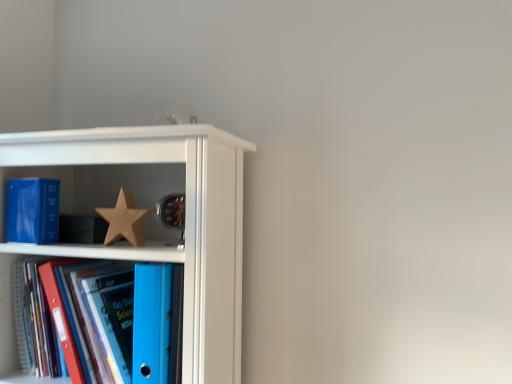
In order to click on blue plastic folder at lower left in this screenshot , I will do `click(97, 320)`.

Find the location of a particular element. white glossy bookshelf at upper left is located at coordinates (154, 219).

Would you say matte blue paperback book at left is a long distance from blue plastic folder at lower left?

That's not correct — matte blue paperback book at left is a little close to blue plastic folder at lower left.

Is matte blue paperback book at left in front of blue plastic folder at lower left?

No, it is not.

Is matte blue paperback book at left at the right side of blue plastic folder at lower left?

No.

Which of these two, matte blue paperback book at left or blue plastic folder at lower left, is bigger?

Bigger between the two is blue plastic folder at lower left.

Does blue plastic folder at lower left appear on the left side of white glossy bookshelf at upper left?

Yes.

Does blue plastic folder at lower left turn towards white glossy bookshelf at upper left?

Yes.

Is blue plastic folder at lower left positioned before white glossy bookshelf at upper left?

No, the depth of blue plastic folder at lower left is greater than that of white glossy bookshelf at upper left.

From a real-world perspective, is blue plastic folder at lower left over white glossy bookshelf at upper left?

No, from a real-world perspective, blue plastic folder at lower left is not over white glossy bookshelf at upper left

Which of these two, wooden star at center or matte blue paperback book at left, is wider?

matte blue paperback book at left.

In terms of height, does wooden star at center look taller or shorter compared to matte blue paperback book at left?

In the image, wooden star at center appears to be shorter than matte blue paperback book at left.

Based on their sizes in the image, would you say wooden star at center is bigger or smaller than matte blue paperback book at left?

Considering their sizes, wooden star at center takes up less space than matte blue paperback book at left.

From a real-world perspective, is wooden star at center located beneath matte blue paperback book at left?

Indeed, from a real-world perspective, wooden star at center is positioned beneath matte blue paperback book at left.

Does blue plastic folder at lower left have a greater width compared to matte blue paperback book at left?

Correct, the width of blue plastic folder at lower left exceeds that of matte blue paperback book at left.

Can you tell me how much blue plastic folder at lower left and matte blue paperback book at left differ in facing direction?

The angle between the facing direction of blue plastic folder at lower left and the facing direction of matte blue paperback book at left is 2.69 degrees.

Is blue plastic folder at lower left far away from matte blue paperback book at left?

Actually, blue plastic folder at lower left and matte blue paperback book at left are a little close together.

From a real-world perspective, is blue plastic folder at lower left located beneath matte blue paperback book at left?

Correct, in the physical world, blue plastic folder at lower left is lower than matte blue paperback book at left.

From the image's perspective, does wooden star at center appear lower than blue plastic folder at lower left?

Actually, wooden star at center appears above blue plastic folder at lower left in the image.

Considering the sizes of wooden star at center and blue plastic folder at lower left in the image, is wooden star at center wider or thinner than blue plastic folder at lower left?

In the image, wooden star at center appears to be more narrow than blue plastic folder at lower left.

Are wooden star at center and blue plastic folder at lower left far apart?

No, wooden star at center is not far away from blue plastic folder at lower left.

Considering the relative positions of wooden star at center and blue plastic folder at lower left in the image provided, is wooden star at center to the left of blue plastic folder at lower left from the viewer's perspective?

In fact, wooden star at center is to the right of blue plastic folder at lower left.

Is wooden star at center at the back of white glossy bookshelf at upper left?

Yes.

Is white glossy bookshelf at upper left behind wooden star at center?

No, white glossy bookshelf at upper left is in front of wooden star at center.

Considering the sizes of white glossy bookshelf at upper left and wooden star at center in the image, is white glossy bookshelf at upper left wider or thinner than wooden star at center?

white glossy bookshelf at upper left is wider than wooden star at center.

Who is smaller, matte blue paperback book at left or wooden star at center?

Smaller between the two is wooden star at center.

Are matte blue paperback book at left and wooden star at center beside each other?

No, matte blue paperback book at left is not beside wooden star at center.

From a real-world perspective, relative to wooden star at center, is matte blue paperback book at left vertically above or below?

Clearly, from a real-world perspective, matte blue paperback book at left is above wooden star at center.

Could you tell me if matte blue paperback book at left is turned towards wooden star at center?

No, matte blue paperback book at left is not oriented towards wooden star at center.

Locate an element on the screen. paperback book behind the blue plastic folder at lower left is located at coordinates (33, 210).

Find the location of a particular element. The width and height of the screenshot is (512, 384). shelf that appears above the blue plastic folder at lower left (from a real-world perspective) is located at coordinates (154, 219).

Considering their positions, is blue plastic folder at lower left positioned closer to white glossy bookshelf at upper left than wooden star at center?

The object closer to white glossy bookshelf at upper left is blue plastic folder at lower left.

From the image, which object appears to be nearer to blue plastic folder at lower left, white glossy bookshelf at upper left or matte blue paperback book at left?

white glossy bookshelf at upper left is closer to blue plastic folder at lower left.

When comparing their distances from white glossy bookshelf at upper left, does blue plastic folder at lower left or matte blue paperback book at left seem further?

Based on the image, matte blue paperback book at left appears to be further to white glossy bookshelf at upper left.

Looking at the image, which one is located closer to matte blue paperback book at left, blue plastic folder at lower left or white glossy bookshelf at upper left?

blue plastic folder at lower left.

Based on their spatial positions, is matte blue paperback book at left or wooden star at center closer to white glossy bookshelf at upper left?

wooden star at center lies closer to white glossy bookshelf at upper left than the other object.

Consider the image. From the image, which object appears to be nearer to wooden star at center, white glossy bookshelf at upper left or matte blue paperback book at left?

matte blue paperback book at left.

Considering their positions, is matte blue paperback book at left positioned closer to blue plastic folder at lower left than white glossy bookshelf at upper left?

Based on the image, white glossy bookshelf at upper left appears to be nearer to blue plastic folder at lower left.

From the image, which object appears to be farther from white glossy bookshelf at upper left, wooden star at center or matte blue paperback book at left?

matte blue paperback book at left is further to white glossy bookshelf at upper left.

Find the location of `star between matte blue paperback book at left and blue plastic folder at lower left in the vertical direction`. star between matte blue paperback book at left and blue plastic folder at lower left in the vertical direction is located at coordinates (124, 220).

At what (x,y) coordinates should I click in order to perform the action: click on shelf between matte blue paperback book at left and wooden star at center. Please return your answer as a coordinate pair (x, y). This screenshot has height=384, width=512. Looking at the image, I should click on (154, 219).

The width and height of the screenshot is (512, 384). In order to click on shelf between wooden star at center and blue plastic folder at lower left in the up-down direction in this screenshot , I will do `click(154, 219)`.

This screenshot has width=512, height=384. What are the coordinates of `shelf that lies between matte blue paperback book at left and blue plastic folder at lower left from top to bottom` in the screenshot? It's located at (154, 219).